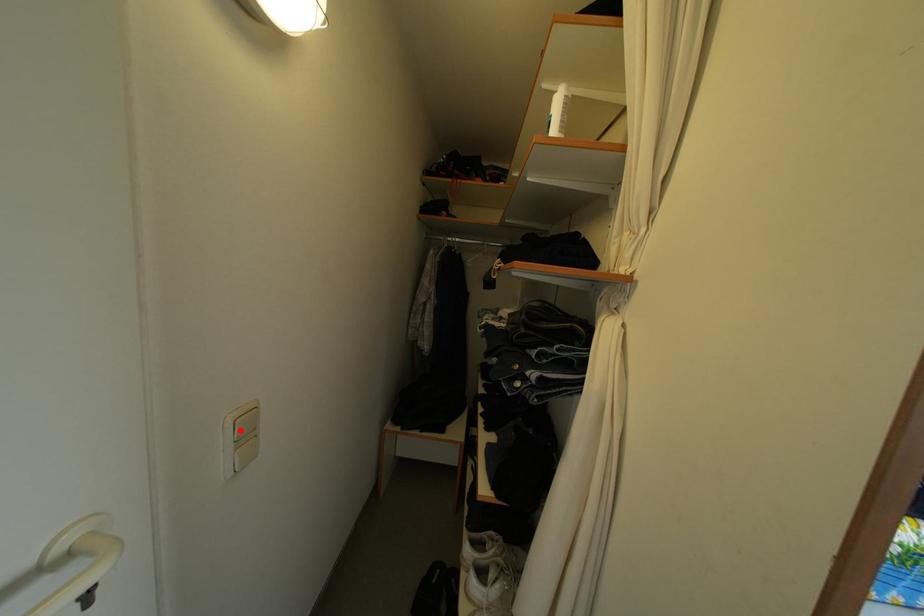
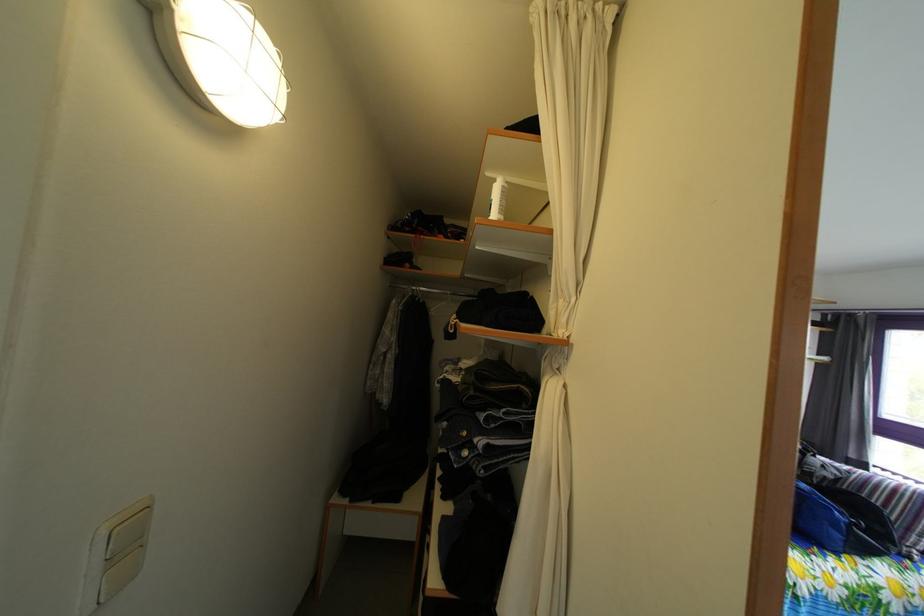
Where in the second image is the point corresponding to the highlighted location from the first image?

(116, 541)